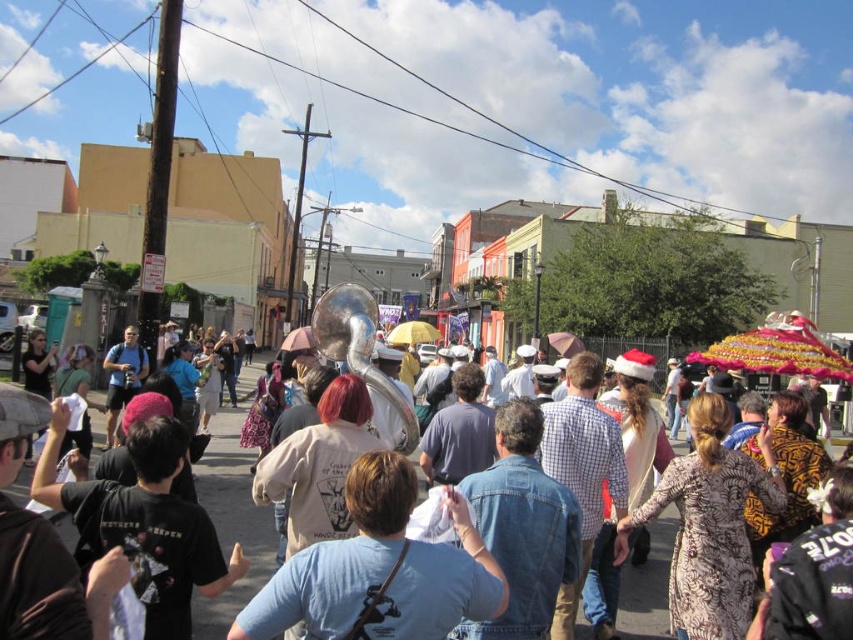
Question: Does blue denim shirt at center appear under denim jacket at center?

Choices:
 (A) yes
 (B) no

Answer: (B)

Question: Can you confirm if blue denim shirt at center is thinner than denim jacket at center?

Choices:
 (A) no
 (B) yes

Answer: (B)

Question: Which point appears farthest from the camera in this image?

Choices:
 (A) (247, 621)
 (B) (229, 493)

Answer: (B)

Question: Which object appears closest to the camera in this image?

Choices:
 (A) blue denim shirt at center
 (B) denim jacket at center

Answer: (A)

Question: Does blue denim shirt at center lie in front of denim jacket at center?

Choices:
 (A) no
 (B) yes

Answer: (B)